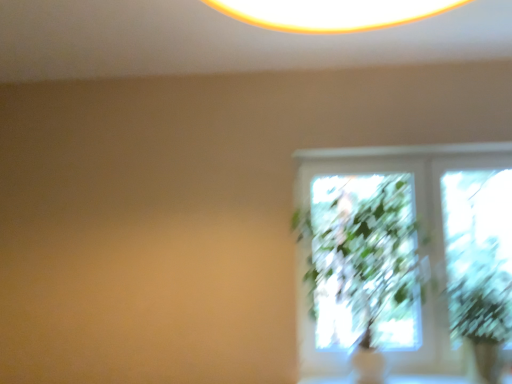
What are the coordinates of `green leafy plant at right` in the screenshot? It's located at point(360,265).

Measure the distance between green leafy plant at right and camera.

green leafy plant at right is 6.63 feet from camera.

What do you see at coordinates (360, 265) in the screenshot?
I see `green leafy plant at right` at bounding box center [360, 265].

Describe the element at coordinates (478, 290) in the screenshot. This screenshot has height=384, width=512. I see `green leafy plant at right` at that location.

The width and height of the screenshot is (512, 384). I want to click on green leafy plant at right, so click(478, 290).

This screenshot has height=384, width=512. What are the coordinates of `green leafy plant at right` in the screenshot? It's located at (360, 265).

Considering the positions of objects green leafy plant at right and green leafy plant at right in the image provided, who is more to the left, green leafy plant at right or green leafy plant at right?

From the viewer's perspective, green leafy plant at right appears more on the left side.

Which object is closer to the camera, green leafy plant at right or green leafy plant at right?

Positioned in front is green leafy plant at right.

Considering the points (336, 311) and (477, 341), which point is in front, point (336, 311) or point (477, 341)?

The point (477, 341) is closer to the camera.

From the image's perspective, is green leafy plant at right under green leafy plant at right?

No, from the image's perspective, green leafy plant at right is not below green leafy plant at right.

From a real-world perspective, is green leafy plant at right positioned above or below green leafy plant at right?

From a real-world perspective, green leafy plant at right is physically above green leafy plant at right.

Looking at their sizes, would you say green leafy plant at right is wider or thinner than green leafy plant at right?

Clearly, green leafy plant at right has more width compared to green leafy plant at right.

Considering the sizes of objects green leafy plant at right and green leafy plant at right in the image provided, who is taller, green leafy plant at right or green leafy plant at right?

With more height is green leafy plant at right.

Considering the relative sizes of green leafy plant at right and green leafy plant at right in the image provided, is green leafy plant at right bigger than green leafy plant at right?

Indeed, green leafy plant at right has a larger size compared to green leafy plant at right.

Would you say green leafy plant at right is outside green leafy plant at right?

green leafy plant at right is positioned outside green leafy plant at right.

Would you consider green leafy plant at right to be distant from green leafy plant at right?

green leafy plant at right is actually quite close to green leafy plant at right.

Does green leafy plant at right turn towards green leafy plant at right?

No, green leafy plant at right is not oriented towards green leafy plant at right.

This screenshot has height=384, width=512. Identify the location of plant behind the green leafy plant at right. (478, 290).

Between green leafy plant at right and green leafy plant at right, which one appears on the left side from the viewer's perspective?

From the viewer's perspective, green leafy plant at right appears more on the left side.

In the image, is green leafy plant at right positioned in front of or behind green leafy plant at right?

Visually, green leafy plant at right is located behind green leafy plant at right.

Which point is more forward, (459, 301) or (415, 296)?

The point (415, 296) is more forward.

From the image's perspective, between green leafy plant at right and green leafy plant at right, which one is located above?

green leafy plant at right.

From a real-world perspective, is green leafy plant at right physically below green leafy plant at right?

Yes.

Considering the relative sizes of green leafy plant at right and green leafy plant at right in the image provided, is green leafy plant at right thinner than green leafy plant at right?

Correct, the width of green leafy plant at right is less than that of green leafy plant at right.

In terms of height, does green leafy plant at right look taller or shorter compared to green leafy plant at right?

Considering their sizes, green leafy plant at right has less height than green leafy plant at right.

Considering the sizes of objects green leafy plant at right and green leafy plant at right in the image provided, who is smaller, green leafy plant at right or green leafy plant at right?

Smaller between the two is green leafy plant at right.

Is green leafy plant at right located within green leafy plant at right?

No, green leafy plant at right is located outside of green leafy plant at right.

Would you consider green leafy plant at right to be distant from green leafy plant at right?

Actually, green leafy plant at right and green leafy plant at right are a little close together.

Is green leafy plant at right facing away from green leafy plant at right?

green leafy plant at right is not turned away from green leafy plant at right.

Can you tell me how much green leafy plant at right and green leafy plant at right differ in facing direction?

The angular difference between green leafy plant at right and green leafy plant at right is 0.000148 degrees.

Locate an element on the screen. plant on the right of green leafy plant at right is located at coordinates point(478,290).

You are a GUI agent. You are given a task and a screenshot of the screen. Output one action in this format:
    pyautogui.click(x=<x>, y=<y>)
    Task: Click on the plant behind the green leafy plant at right
    This screenshot has width=512, height=384.
    Given the screenshot: What is the action you would take?
    pyautogui.click(x=478, y=290)

I want to click on houseplant in front of the green leafy plant at right, so click(360, 265).